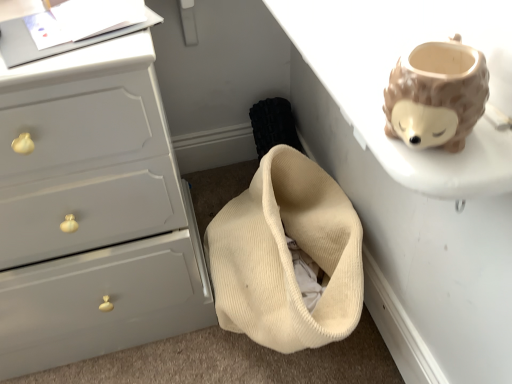
Question: Should I look upward or downward to see matte gray chest of drawers at left?

Choices:
 (A) up
 (B) down

Answer: (A)

Question: Does white matte table at upper right have a greater height compared to matte gray chest of drawers at left?

Choices:
 (A) no
 (B) yes

Answer: (A)

Question: Is white matte table at upper right next to matte gray chest of drawers at left and touching it?

Choices:
 (A) yes
 (B) no

Answer: (B)

Question: From a real-world perspective, does white matte table at upper right sit lower than matte gray chest of drawers at left?

Choices:
 (A) yes
 (B) no

Answer: (B)

Question: Would you consider white matte table at upper right to be distant from matte gray chest of drawers at left?

Choices:
 (A) yes
 (B) no

Answer: (B)

Question: Considering the relative sizes of white matte table at upper right and matte gray chest of drawers at left in the image provided, is white matte table at upper right bigger than matte gray chest of drawers at left?

Choices:
 (A) yes
 (B) no

Answer: (B)

Question: From a real-world perspective, is white matte table at upper right positioned over matte gray chest of drawers at left based on gravity?

Choices:
 (A) no
 (B) yes

Answer: (B)

Question: Is matte gray chest of drawers at left placed right next to white matte table at upper right?

Choices:
 (A) yes
 (B) no

Answer: (B)

Question: Is matte gray chest of drawers at left not inside white matte table at upper right?

Choices:
 (A) yes
 (B) no

Answer: (A)

Question: Does matte gray chest of drawers at left have a larger size compared to white matte table at upper right?

Choices:
 (A) yes
 (B) no

Answer: (A)

Question: Is matte gray chest of drawers at left wider than white matte table at upper right?

Choices:
 (A) no
 (B) yes

Answer: (A)

Question: Considering the relative positions of matte gray chest of drawers at left and white matte table at upper right in the image provided, is matte gray chest of drawers at left to the left of white matte table at upper right from the viewer's perspective?

Choices:
 (A) no
 (B) yes

Answer: (B)

Question: Does matte gray chest of drawers at left have a lesser height compared to white matte table at upper right?

Choices:
 (A) no
 (B) yes

Answer: (A)

Question: From the image's perspective, relative to white matte table at upper right, is matte gray chest of drawers at left above or below?

Choices:
 (A) above
 (B) below

Answer: (B)